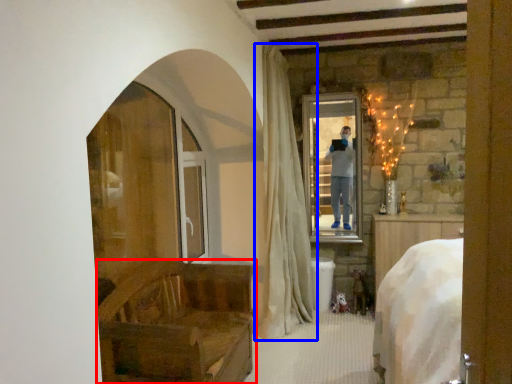
Question: Which object appears closest to the camera in this image, furniture (highlighted by a red box) or curtain (highlighted by a blue box)?

Choices:
 (A) furniture
 (B) curtain

Answer: (A)